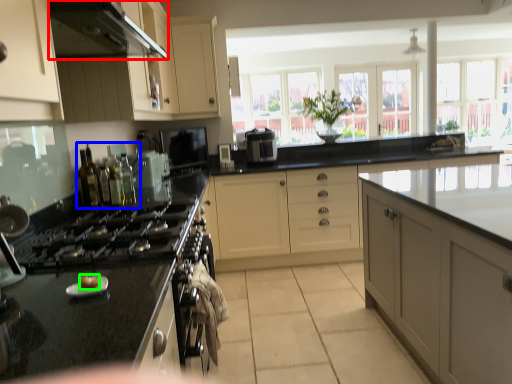
Question: Based on their relative distances, which object is farther from exhaust hood (highlighted by a red box)? Choose from bottle (highlighted by a blue box) and food (highlighted by a green box).

Choices:
 (A) bottle
 (B) food

Answer: (B)